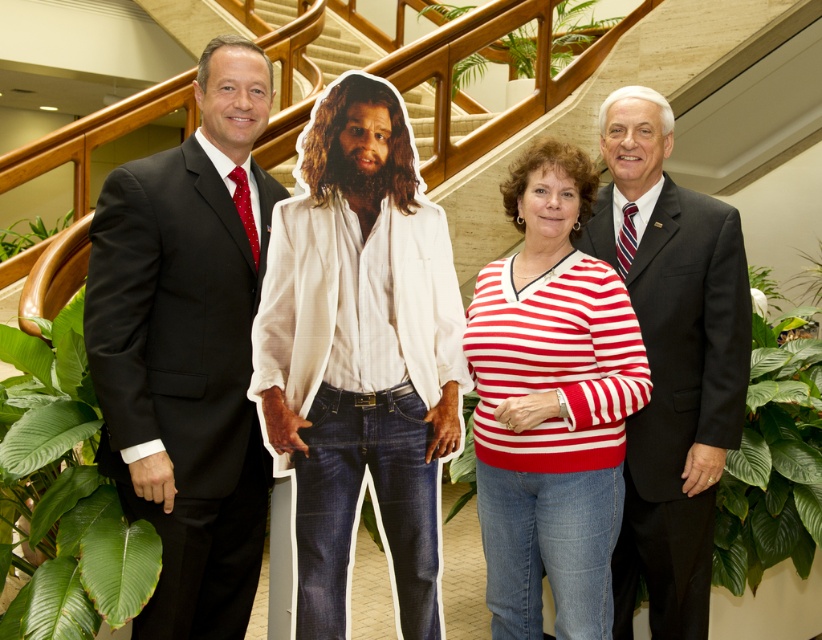
Who is more forward, (x=302, y=291) or (x=815, y=284)?

Point (x=302, y=291) is more forward.

Is point (455, 419) farther from camera compared to point (806, 260)?

No, (455, 419) is closer to viewer.

At what (x,y) coordinates should I click in order to perform the action: click on white cotton shirt at center. Please return your answer as a coordinate pair (x, y). Image resolution: width=822 pixels, height=640 pixels. Looking at the image, I should click on (359, 355).

Which is above, matte black suit at right or green leafy plant at lower center?

matte black suit at right is higher up.

Can you confirm if matte black suit at right is thinner than green leafy plant at lower center?

No.

Locate an element on the screen. The image size is (822, 640). matte black suit at right is located at coordinates click(670, 362).

This screenshot has height=640, width=822. Identify the location of matte black suit at right. (670, 362).

In the scene shown: Does striped knit sweater at center appear on the left side of green leafy plant at center?

Indeed, striped knit sweater at center is positioned on the left side of green leafy plant at center.

Is striped knit sweater at center taller than green leafy plant at center?

Indeed, striped knit sweater at center has a greater height compared to green leafy plant at center.

Locate an element on the screen. striped knit sweater at center is located at coordinates (552, 403).

Where is `striped knit sweater at center`? This screenshot has height=640, width=822. striped knit sweater at center is located at coordinates (552, 403).